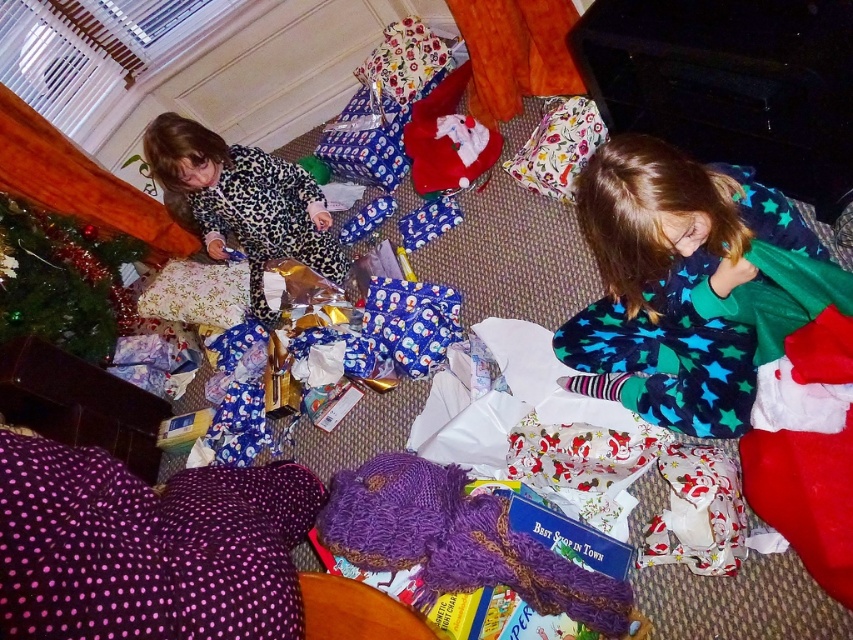
Question: Estimate the real-world distances between objects in this image. Which object is closer to the blue star-patterned pajamas at lower right?

Choices:
 (A) purple polka dot blanket at lower left
 (B) leopard print pajamas at left

Answer: (A)

Question: Which point is farther from the camera taking this photo?

Choices:
 (A) (250, 467)
 (B) (273, 177)
 (C) (665, 323)
 (D) (62, 342)

Answer: (D)

Question: Estimate the real-world distances between objects in this image. Which object is farther from the leopard print pajamas at left?

Choices:
 (A) blue star-patterned pajamas at lower right
 (B) green artificial at left
 (C) purple polka dot blanket at lower left

Answer: (A)

Question: Where is purple polka dot blanket at lower left located in relation to leopard print pajamas at left in the image?

Choices:
 (A) left
 (B) right

Answer: (B)

Question: Can you confirm if blue star-patterned pajamas at lower right is smaller than green artificial at left?

Choices:
 (A) yes
 (B) no

Answer: (B)

Question: In this image, where is purple polka dot blanket at lower left located relative to leopard print pajamas at left?

Choices:
 (A) right
 (B) left

Answer: (A)